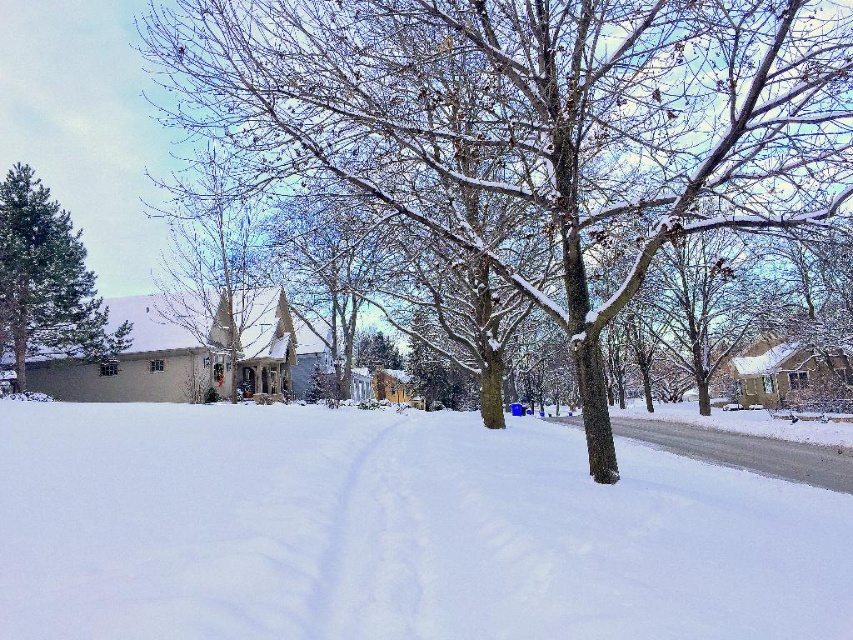
You are planning to build a snowman using the white fluffy snow at center and the green matte tree at upper left as a reference. Which object should you use as the base for the snowman and why?

The white fluffy snow at center should be used as the base for the snowman because it is wider than the green matte tree at upper left, providing a more stable and larger foundation.